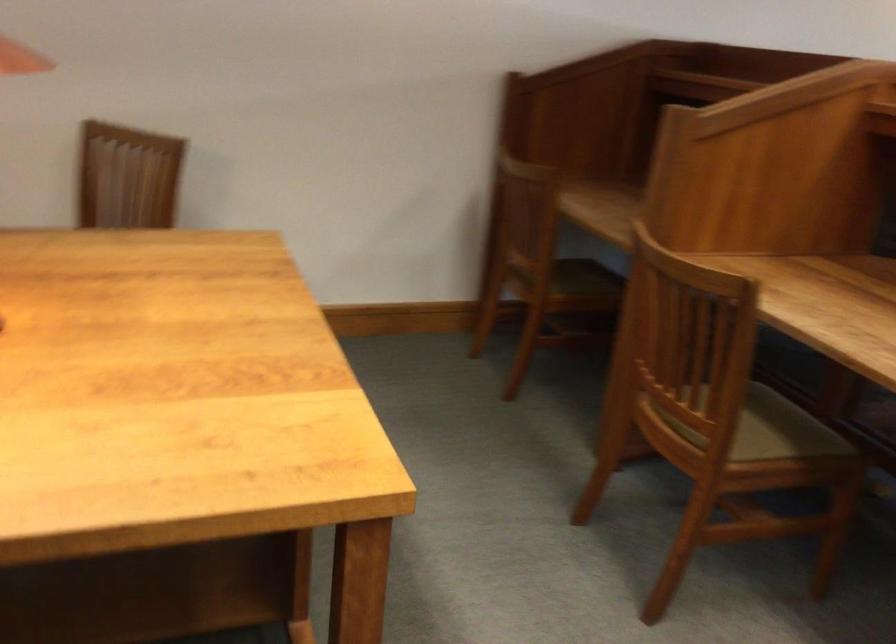
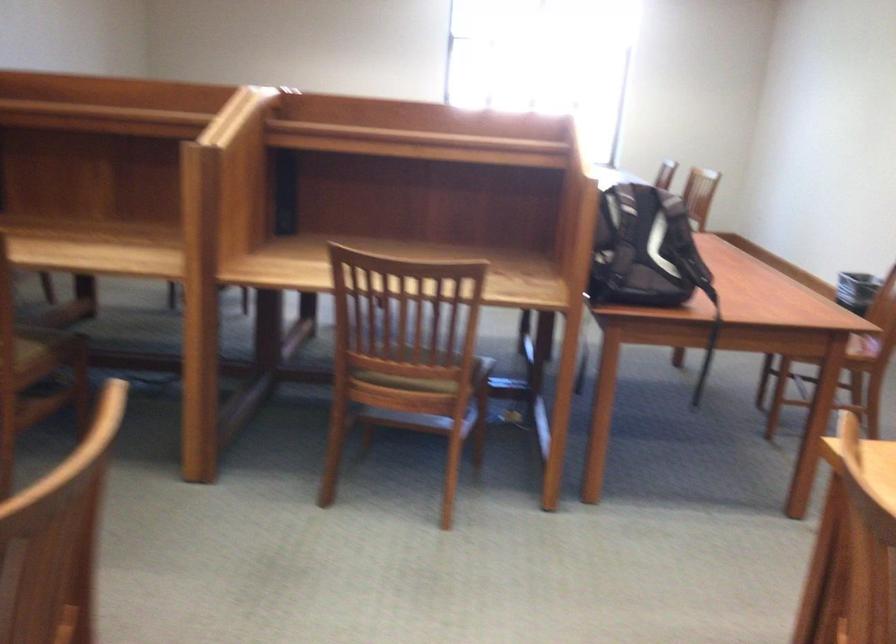
The point at [787,468] is marked in the first image. Where is the corresponding point in the second image?

(46, 348)